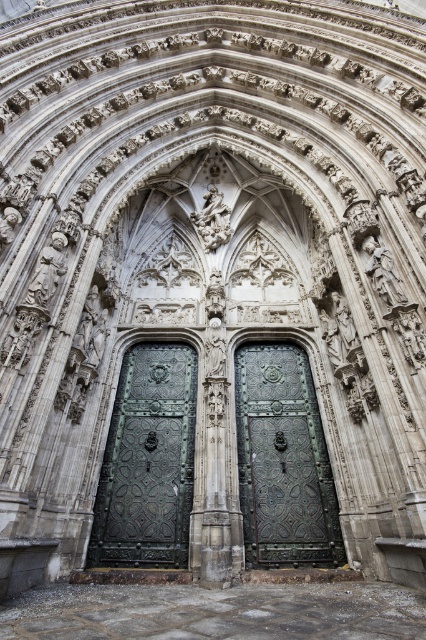
You are an architect visiting the cathedral and want to examine both doors. Which door should you look to your left side to inspect first, the bronze textured door at center or the bronze ornate door at center?

The bronze textured door at center is to the left of the bronze ornate door at center, so you should look to your left side to inspect the bronze textured door at center first.

You are standing in front of the cathedral entrance. The bronze textured door at center is located at coordinates point 0.722, 0.347. If you want to reach the door, which direction should you move relative to your current position?

The bronze textured door at center is located at coordinates point (147, 461). Since you are standing in front of the cathedral entrance, you should move forward towards the center to reach the door.

You are standing in front of the cathedral entrance and want to take a photo that captures both point (163, 401) and point (288, 522). Which point will appear closer to the bottom of the photo?

Point (288, 522) will appear closer to the bottom of the photo because it is farther from the camera compared to point (163, 401).